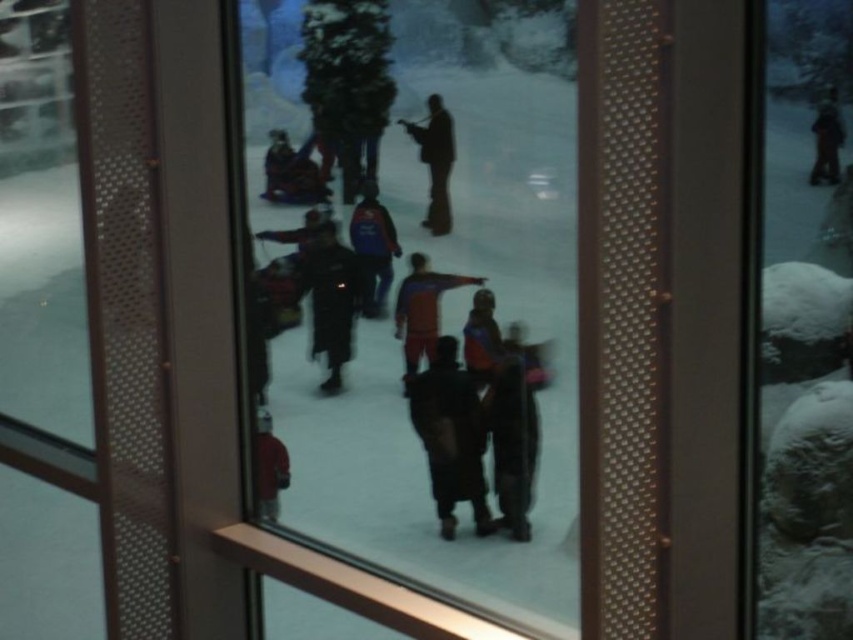
The width and height of the screenshot is (853, 640). Describe the element at coordinates (424, 291) in the screenshot. I see `transparent glass at center` at that location.

Does transparent glass at center have a larger size compared to dark blue jacket at upper right?

Yes, transparent glass at center is bigger than dark blue jacket at upper right.

Find the location of a particular element. The image size is (853, 640). transparent glass at center is located at coordinates (424, 291).

Identify the location of transparent glass at center. (424, 291).

Does transparent glass at center have a smaller size compared to dark brown leather pants at center?

No.

Is point (287, 106) positioned behind point (498, 452)?

Yes, it is.

The width and height of the screenshot is (853, 640). Identify the location of transparent glass at center. (424, 291).

Does dark brown jacket at center have a larger size compared to dark brown leather pants at center?

Yes, dark brown jacket at center is bigger than dark brown leather pants at center.

Is point (466, 460) more distant than point (532, 404)?

Yes, point (466, 460) is behind point (532, 404).

Who is more distant from viewer, (485, 499) or (518, 397)?

The point (485, 499) is more distant.

The image size is (853, 640). In order to click on dark brown jacket at center in this screenshot , I will do `click(450, 435)`.